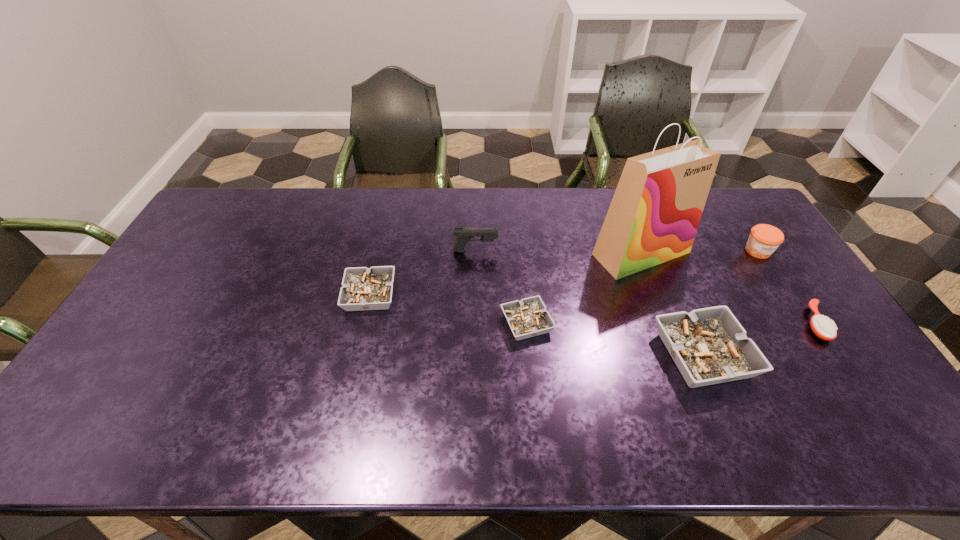
The width and height of the screenshot is (960, 540). I want to click on vacant area that satisfies the following two spatial constraints: 1. at the barrel of the tallest object; 2. on the right side of the second object from left to right, so click(x=475, y=253).

You are a GUI agent. You are given a task and a screenshot of the screen. Output one action in this format:
    pyautogui.click(x=<x>, y=<y>)
    Task: Click on the vacant space that satisfies the following two spatial constraints: 1. on the front side of the shortest ashtray; 2. on the left side of the hairbrush
    
    Given the screenshot: What is the action you would take?
    pyautogui.click(x=527, y=323)

At what (x,y) coordinates should I click in order to perform the action: click on free space that satisfies the following two spatial constraints: 1. at the barrel of the pistol; 2. on the back side of the shopping bag. Please return your answer as a coordinate pair (x, y). This screenshot has height=540, width=960. Looking at the image, I should click on (475, 253).

Identify the location of vacant region that satisfies the following two spatial constraints: 1. at the barrel of the tallest ashtray; 2. on the left side of the second tallest object. The height and width of the screenshot is (540, 960). (474, 355).

At what (x,y) coordinates should I click in order to perform the action: click on free space that satisfies the following two spatial constraints: 1. on the back side of the hairbrush; 2. at the barrel of the pistol. Please return your answer as a coordinate pair (x, y). This screenshot has width=960, height=540. Looking at the image, I should click on (766, 251).